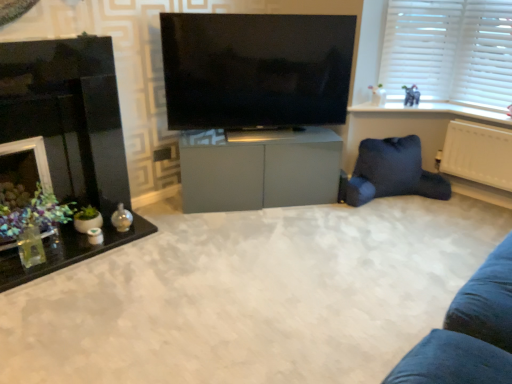
I want to click on free point in front of black glossy fireplace at left, so click(69, 315).